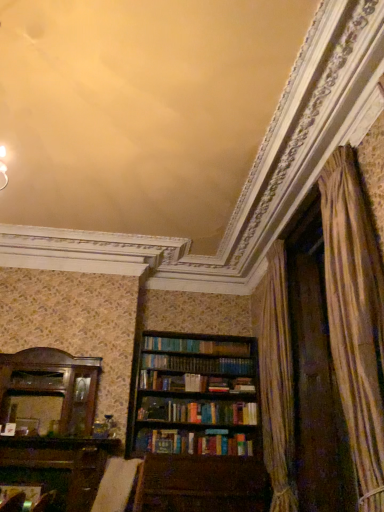
Question: Should I look upward or downward to see wooden bookcase at center?

Choices:
 (A) up
 (B) down

Answer: (B)